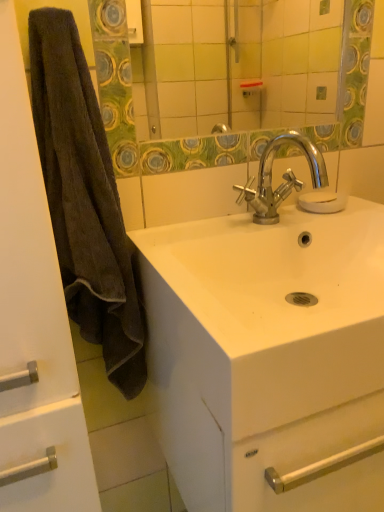
Question: Does transparent glass soap at center have a larger size compared to brown fuzzy towel at left?

Choices:
 (A) no
 (B) yes

Answer: (A)

Question: Is transparent glass soap at center oriented away from brown fuzzy towel at left?

Choices:
 (A) no
 (B) yes

Answer: (A)

Question: Considering the relative sizes of transparent glass soap at center and brown fuzzy towel at left in the image provided, is transparent glass soap at center wider than brown fuzzy towel at left?

Choices:
 (A) no
 (B) yes

Answer: (A)

Question: Is transparent glass soap at center closer to the viewer compared to brown fuzzy towel at left?

Choices:
 (A) no
 (B) yes

Answer: (A)

Question: Is transparent glass soap at center next to brown fuzzy towel at left and touching it?

Choices:
 (A) no
 (B) yes

Answer: (A)

Question: Considering the relative positions of transparent glass soap at center and brown fuzzy towel at left in the image provided, is transparent glass soap at center to the right of brown fuzzy towel at left from the viewer's perspective?

Choices:
 (A) yes
 (B) no

Answer: (A)

Question: Considering the relative sizes of white glossy sink at center and transparent glass soap at center in the image provided, is white glossy sink at center wider than transparent glass soap at center?

Choices:
 (A) yes
 (B) no

Answer: (A)

Question: Is white glossy sink at center positioned before transparent glass soap at center?

Choices:
 (A) no
 (B) yes

Answer: (B)

Question: From the image's perspective, is white glossy sink at center on top of transparent glass soap at center?

Choices:
 (A) yes
 (B) no

Answer: (B)

Question: Is white glossy sink at center shorter than transparent glass soap at center?

Choices:
 (A) no
 (B) yes

Answer: (A)

Question: Does white glossy sink at center have a lesser width compared to transparent glass soap at center?

Choices:
 (A) yes
 (B) no

Answer: (B)

Question: Is transparent glass soap at center inside white glossy sink at center?

Choices:
 (A) yes
 (B) no

Answer: (B)

Question: Is brown fuzzy towel at left directly adjacent to transparent glass soap at center?

Choices:
 (A) no
 (B) yes

Answer: (A)